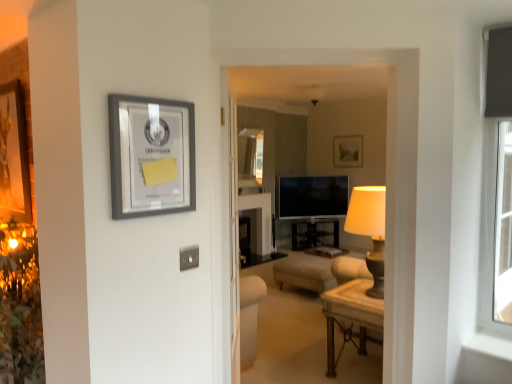
What do you see at coordinates (151, 156) in the screenshot? This screenshot has width=512, height=384. I see `matte gray picture frame at upper left` at bounding box center [151, 156].

Locate an element on the screen. The width and height of the screenshot is (512, 384). matte black tv at center is located at coordinates (311, 196).

Image resolution: width=512 pixels, height=384 pixels. What are the coordinates of `matte gray picture frame at upper left` in the screenshot? It's located at (151, 156).

Between matte gray picture frame at upper left and matte black tv at center, which one is positioned in front?

matte gray picture frame at upper left is in front.

Between matte gray picture frame at upper left and matte black tv at center, which one has more height?

With more height is matte black tv at center.

The width and height of the screenshot is (512, 384). I want to click on picture frame above the matte black tv at center (from a real-world perspective), so click(151, 156).

Based on their sizes in the image, would you say matte gray picture frame at upper left is bigger or smaller than matte black tv at center?

Clearly, matte gray picture frame at upper left is smaller in size than matte black tv at center.

You are a GUI agent. You are given a task and a screenshot of the screen. Output one action in this format:
    pyautogui.click(x=<x>, y=<y>)
    Task: Click on the television on the right of matte gray picture frame at upper left
    
    Given the screenshot: What is the action you would take?
    pyautogui.click(x=311, y=196)

Is matte black tv at center bigger than matte gray picture frame at upper left?

Correct, matte black tv at center is larger in size than matte gray picture frame at upper left.

Which object is positioned more to the left, matte black tv at center or matte gray picture frame at upper left?

Positioned to the left is matte gray picture frame at upper left.

Is matte black tv at center directly adjacent to matte gray picture frame at upper left?

No, matte black tv at center is not making contact with matte gray picture frame at upper left.

Who is smaller, wooden polished table at center or matte black tv at center?

With smaller size is matte black tv at center.

Is wooden polished table at center situated inside matte black tv at center or outside?

The correct answer is: outside.

Who is more distant, wooden polished table at center or matte black tv at center?

matte black tv at center is more distant.

How distant is wooden polished table at center from matte black tv at center?

A distance of 3.06 meters exists between wooden polished table at center and matte black tv at center.

Is the depth of matte black tv at center greater than that of wooden polished table at center?

Yes, the depth of matte black tv at center is greater than that of wooden polished table at center.

Which object is positioned more to the right, matte black tv at center or wooden polished table at center?

matte black tv at center.

Can you tell me how much matte black tv at center and wooden polished table at center differ in facing direction?

145 degrees separate the facing orientations of matte black tv at center and wooden polished table at center.

Does matte black tv at center have a smaller size compared to wooden polished table at center?

Correct, matte black tv at center occupies less space than wooden polished table at center.

Is matte gray picture frame at upper left wider or thinner than wooden polished table at center?

matte gray picture frame at upper left is thinner than wooden polished table at center.

Where is `table lying behind the matte gray picture frame at upper left`? The height and width of the screenshot is (384, 512). table lying behind the matte gray picture frame at upper left is located at coordinates (350, 315).

Considering the relative sizes of matte gray picture frame at upper left and wooden polished table at center in the image provided, is matte gray picture frame at upper left smaller than wooden polished table at center?

Indeed, matte gray picture frame at upper left has a smaller size compared to wooden polished table at center.

Measure the distance from wooden polished table at center to matte gray picture frame at upper left.

wooden polished table at center is 1.93 meters from matte gray picture frame at upper left.

Considering the sizes of wooden polished table at center and matte gray picture frame at upper left in the image, is wooden polished table at center taller or shorter than matte gray picture frame at upper left?

Clearly, wooden polished table at center is taller compared to matte gray picture frame at upper left.

Locate an element on the screen. Image resolution: width=512 pixels, height=384 pixels. table that appears below the matte gray picture frame at upper left (from the image's perspective) is located at coordinates (350, 315).

Is wooden polished table at center not inside matte gray picture frame at upper left?

Yes, wooden polished table at center is outside of matte gray picture frame at upper left.

Where is `television that appears below the matte gray picture frame at upper left (from a real-world perspective)`? The height and width of the screenshot is (384, 512). television that appears below the matte gray picture frame at upper left (from a real-world perspective) is located at coordinates (311, 196).

Find the location of a particular element. Image resolution: width=512 pixels, height=384 pixels. picture frame that appears above the matte black tv at center (from a real-world perspective) is located at coordinates (x=151, y=156).

Estimate the real-world distances between objects in this image. Which object is closer to matte black tv at center, matte gray picture frame at upper left or wooden polished table at center?

wooden polished table at center lies closer to matte black tv at center than the other object.

Looking at the image, which one is located closer to matte gray picture frame at upper left, wooden polished table at center or matte black tv at center?

wooden polished table at center lies closer to matte gray picture frame at upper left than the other object.

In the scene shown: From the image, which object appears to be farther from wooden polished table at center, matte black tv at center or matte gray picture frame at upper left?

matte black tv at center.

When comparing their distances from matte gray picture frame at upper left, does matte black tv at center or wooden polished table at center seem closer?

wooden polished table at center is positioned closer to the anchor matte gray picture frame at upper left.

Looking at the image, which one is located closer to matte black tv at center, wooden polished table at center or matte gray picture frame at upper left?

→ wooden polished table at center is positioned closer to the anchor matte black tv at center.

Looking at this image, looking at the image, which one is located closer to wooden polished table at center, matte gray picture frame at upper left or matte black tv at center?

matte gray picture frame at upper left lies closer to wooden polished table at center than the other object.

This screenshot has width=512, height=384. In order to click on table between matte gray picture frame at upper left and matte black tv at center along the z-axis in this screenshot , I will do [350, 315].